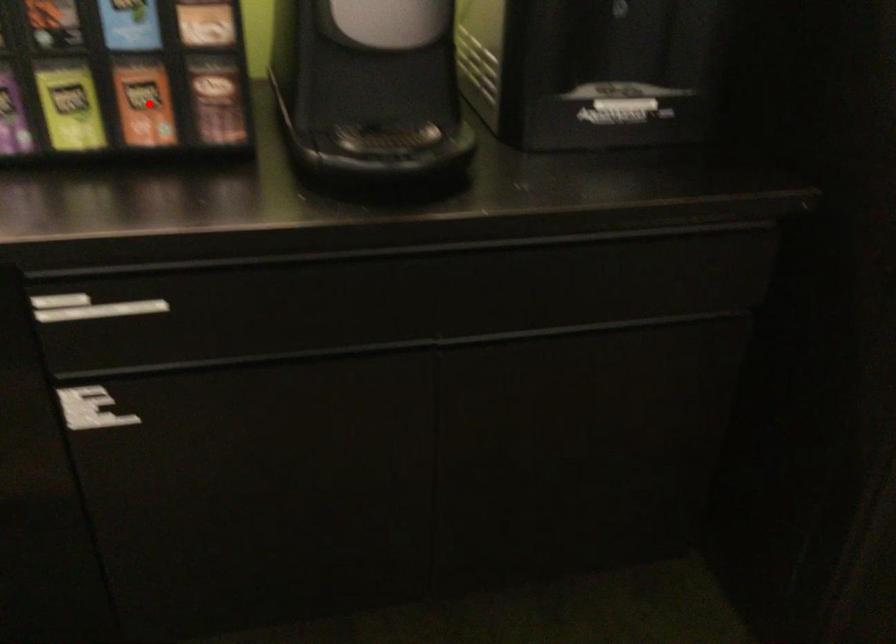
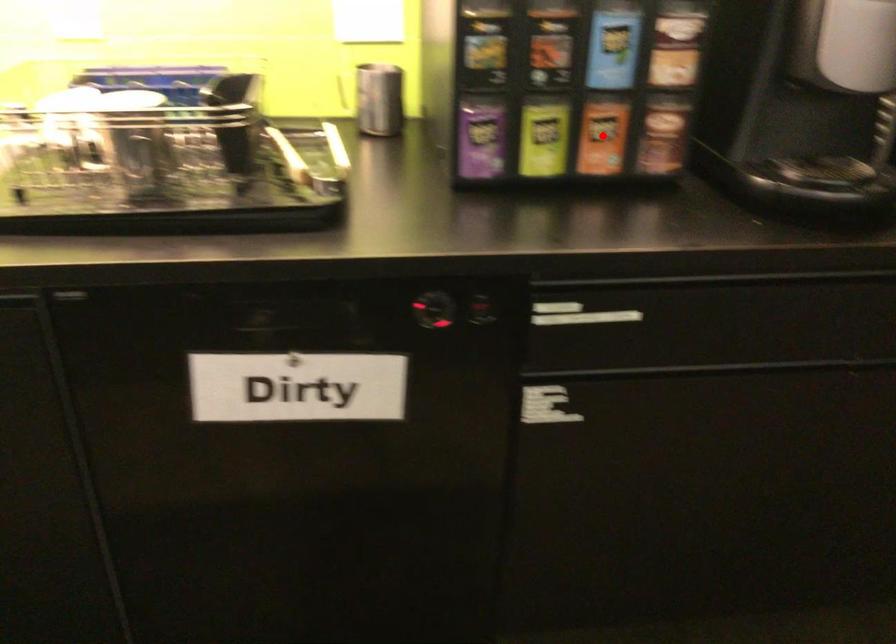
I am providing you with two images of the same scene from different viewpoints. A red point is marked on the first image and another point is marked on the second image. Is the marked point in image1 the same physical position as the marked point in image2?

Yes